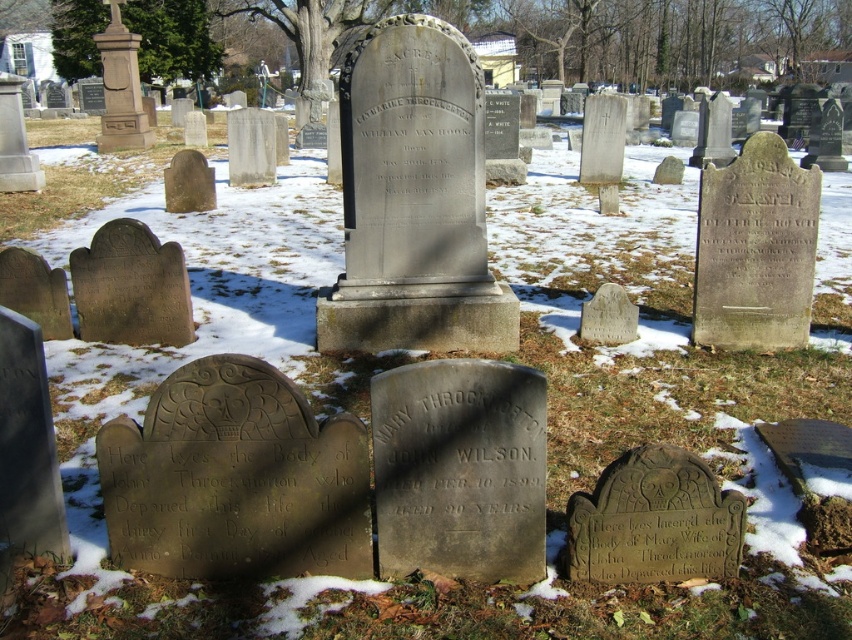
Question: Does green leafy tree at upper left come in front of green textured tree at upper center?

Choices:
 (A) yes
 (B) no

Answer: (B)

Question: Which is nearer to the green leafy tree at upper left?

Choices:
 (A) bare wood tree at upper center
 (B) green textured tree at upper center

Answer: (B)

Question: Which point is closer to the camera?

Choices:
 (A) bare wood tree at upper center
 (B) green textured tree at upper center

Answer: (B)

Question: Can you confirm if green leafy tree at upper left is bigger than green textured tree at upper center?

Choices:
 (A) no
 (B) yes

Answer: (A)

Question: Which of the following is the closest to the observer?

Choices:
 (A) (148, 45)
 (B) (820, 54)

Answer: (A)

Question: Can you confirm if green textured tree at upper center is positioned to the left of bare wood tree at upper center?

Choices:
 (A) no
 (B) yes

Answer: (B)